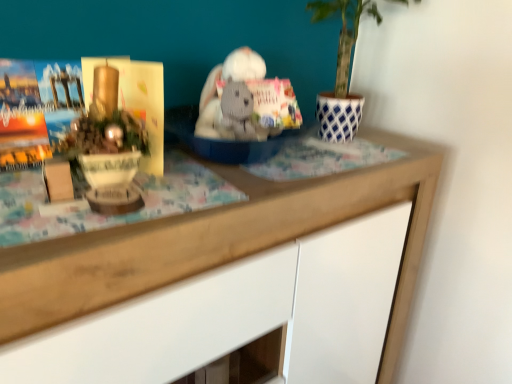
Question: Considering their positions, is wooden desk at center located in front of or behind matte gold paperback book at left?

Choices:
 (A) front
 (B) behind

Answer: (A)

Question: From the image's perspective, is wooden desk at center located above or below matte gold paperback book at left?

Choices:
 (A) below
 (B) above

Answer: (A)

Question: Which is farther from the white knitted bear at center?

Choices:
 (A) matte gold paperback book at left
 (B) wooden desk at center

Answer: (B)

Question: Estimate the real-world distances between objects in this image. Which object is closer to the wooden desk at center?

Choices:
 (A) white knitted bear at center
 (B) matte gold paperback book at left

Answer: (A)